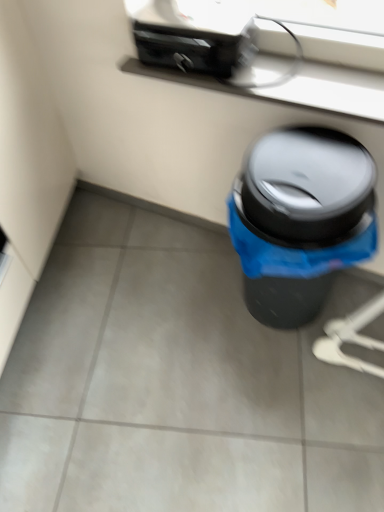
What is the approximate width of black plastic trash can at lower right?

black plastic trash can at lower right is 14.33 inches wide.

I want to click on black plastic toaster at upper center, so click(193, 35).

Which of these two, black plastic toaster at upper center or satin black window sill at upper center, stands shorter?

satin black window sill at upper center.

Between black plastic toaster at upper center and satin black window sill at upper center, which one is positioned in front?

satin black window sill at upper center is more forward.

Can you tell me how much black plastic toaster at upper center and satin black window sill at upper center differ in facing direction?

8.9e-05 degrees separate the facing orientations of black plastic toaster at upper center and satin black window sill at upper center.

Is satin black window sill at upper center inside black plastic toaster at upper center?

Actually, satin black window sill at upper center is outside black plastic toaster at upper center.

Which of these two, black plastic trash can at lower right or black plastic toaster at upper center, is bigger?

With larger size is black plastic trash can at lower right.

Can you confirm if black plastic trash can at lower right is wider than black plastic toaster at upper center?

Correct, the width of black plastic trash can at lower right exceeds that of black plastic toaster at upper center.

Is black plastic trash can at lower right not inside black plastic toaster at upper center?

Absolutely, black plastic trash can at lower right is external to black plastic toaster at upper center.

Is point (315, 242) closer or farther from the camera than point (144, 34)?

Point (315, 242) appears to be closer to the viewer than point (144, 34).

From the image's perspective, does black plastic toaster at upper center appear higher than black plastic trash can at lower right?

Indeed, from the image's perspective, black plastic toaster at upper center is shown above black plastic trash can at lower right.

Considering the points (148, 22) and (305, 138), which point is in front, point (148, 22) or point (305, 138)?

Positioned in front is point (305, 138).

Is the depth of black plastic toaster at upper center greater than that of black plastic trash can at lower right?

Yes, it is behind black plastic trash can at lower right.

From a real-world perspective, which object stands above the other?

black plastic toaster at upper center is physically above.

From a real-world perspective, is black plastic trash can at lower right below satin black window sill at upper center?

Yes, from a real-world perspective, black plastic trash can at lower right is beneath satin black window sill at upper center.

This screenshot has width=384, height=512. I want to click on waste container below the satin black window sill at upper center (from a real-world perspective), so click(x=301, y=219).

In the scene shown: Is black plastic trash can at lower right taller or shorter than satin black window sill at upper center?

Considering their sizes, black plastic trash can at lower right has more height than satin black window sill at upper center.

Considering the relative positions of satin black window sill at upper center and black plastic trash can at lower right in the image provided, is satin black window sill at upper center in front of black plastic trash can at lower right?

No, it is behind black plastic trash can at lower right.

Looking at this image, from the image's perspective, is satin black window sill at upper center above black plastic trash can at lower right?

Yes, from the image's perspective, satin black window sill at upper center is above black plastic trash can at lower right.

Looking at this image, which is more distant, (x=315, y=88) or (x=342, y=242)?

The point (x=315, y=88) is more distant.

From the image's perspective, is satin black window sill at upper center located beneath black plastic toaster at upper center?

Correct, satin black window sill at upper center appears lower than black plastic toaster at upper center in the image.

I want to click on window sill below the black plastic toaster at upper center (from the image's perspective), so click(x=296, y=87).

Find the location of a particular element. window sill on the right side of black plastic toaster at upper center is located at coordinates (296, 87).

Locate an element on the screen. waste container in front of the black plastic toaster at upper center is located at coordinates (301, 219).

Based on their spatial positions, is satin black window sill at upper center or black plastic toaster at upper center closer to black plastic trash can at lower right?

satin black window sill at upper center lies closer to black plastic trash can at lower right than the other object.

Looking at the image, which one is located further to satin black window sill at upper center, black plastic trash can at lower right or black plastic toaster at upper center?

black plastic trash can at lower right is further to satin black window sill at upper center.

Considering their positions, is black plastic toaster at upper center positioned further to satin black window sill at upper center than black plastic trash can at lower right?

black plastic trash can at lower right is positioned further to the anchor satin black window sill at upper center.

Based on their spatial positions, is black plastic toaster at upper center or satin black window sill at upper center further from black plastic trash can at lower right?

black plastic toaster at upper center is further to black plastic trash can at lower right.

From the image, which object appears to be farther from black plastic toaster at upper center, black plastic trash can at lower right or satin black window sill at upper center?

black plastic trash can at lower right.

Looking at the image, which one is located further to black plastic toaster at upper center, satin black window sill at upper center or black plastic trash can at lower right?

Among the two, black plastic trash can at lower right is located further to black plastic toaster at upper center.

You are a GUI agent. You are given a task and a screenshot of the screen. Output one action in this format:
    pyautogui.click(x=<x>, y=<y>)
    Task: Click on the window sill between black plastic toaster at upper center and black plastic trash can at lower right in the vertical direction
    The height and width of the screenshot is (512, 384).
    Given the screenshot: What is the action you would take?
    pyautogui.click(x=296, y=87)